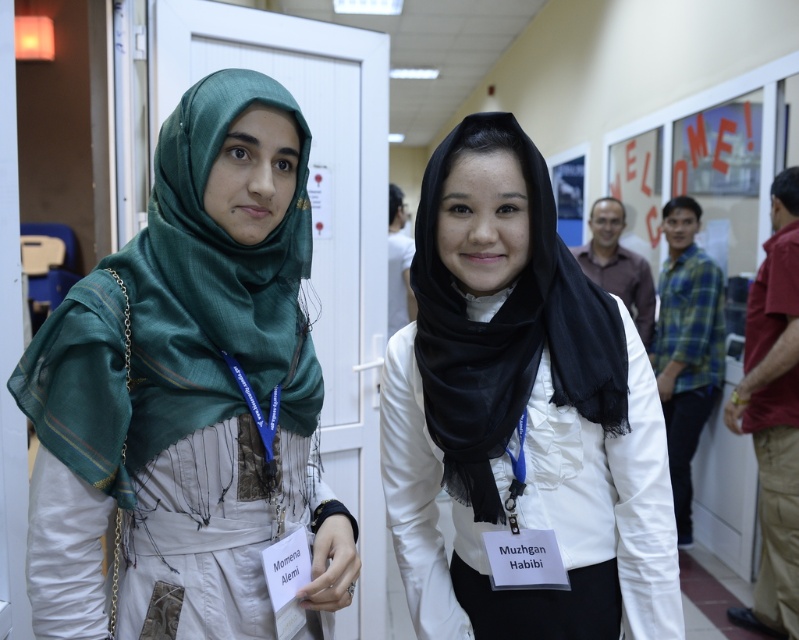
I want to click on green silk hijab at left, so click(x=189, y=394).

Can you confirm if green silk hijab at left is thinner than black sheer scarf at center?

In fact, green silk hijab at left might be wider than black sheer scarf at center.

Is point (215, 568) positioned before point (583, 280)?

Yes, it is in front of point (583, 280).

Locate an element on the screen. green silk hijab at left is located at coordinates (189, 394).